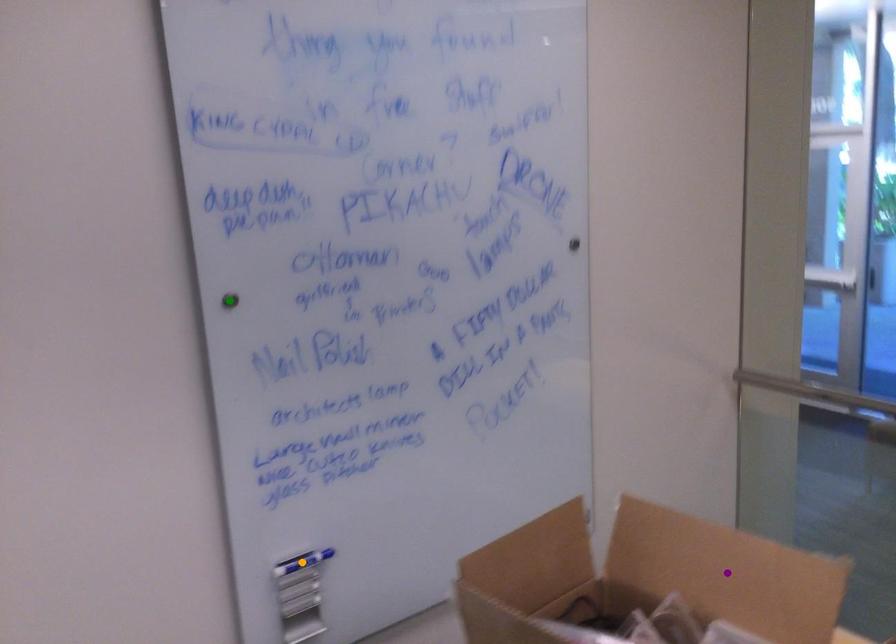
Consider the image. Order these from nearest to farthest:
1. orange point
2. purple point
3. green point

1. purple point
2. green point
3. orange point